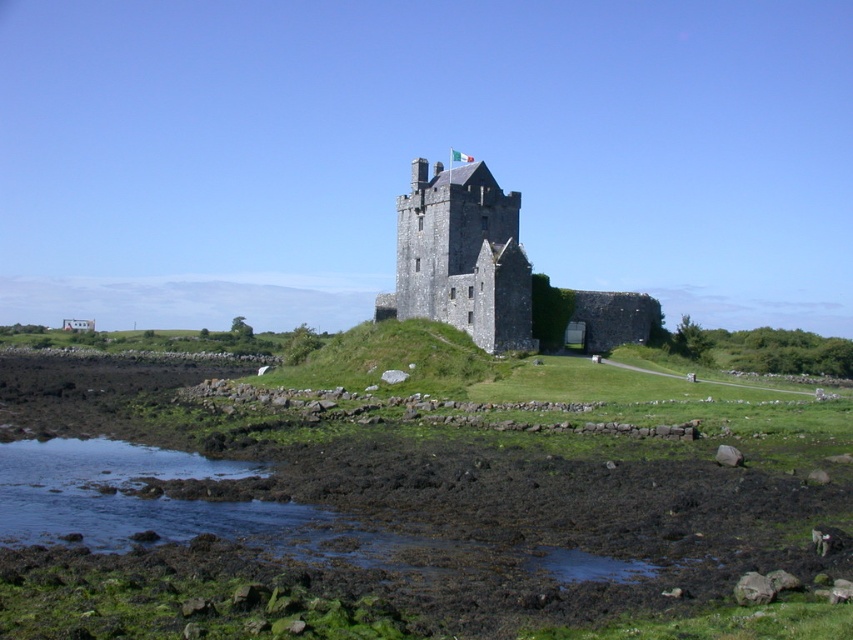
Is the position of black mud at lower left less distant than that of dark gray stone castle at center?

Yes, it is in front of dark gray stone castle at center.

Can you confirm if black mud at lower left is taller than dark gray stone castle at center?

No.

Is point (68, 531) more distant than point (413, 232)?

No, (68, 531) is closer to viewer.

This screenshot has width=853, height=640. I want to click on black mud at lower left, so click(372, 545).

Which of these two, dark gray stone castle at center or clear water at lower left, stands shorter?

clear water at lower left is shorter.

Does dark gray stone castle at center have a lesser width compared to clear water at lower left?

No.

The width and height of the screenshot is (853, 640). Describe the element at coordinates (462, 257) in the screenshot. I see `dark gray stone castle at center` at that location.

Where is `dark gray stone castle at center`? Image resolution: width=853 pixels, height=640 pixels. dark gray stone castle at center is located at coordinates (462, 257).

Image resolution: width=853 pixels, height=640 pixels. Describe the element at coordinates (372, 545) in the screenshot. I see `black mud at lower left` at that location.

From the picture: Is black mud at lower left shorter than clear water at lower left?

No.

Where is `black mud at lower left`? black mud at lower left is located at coordinates (372, 545).